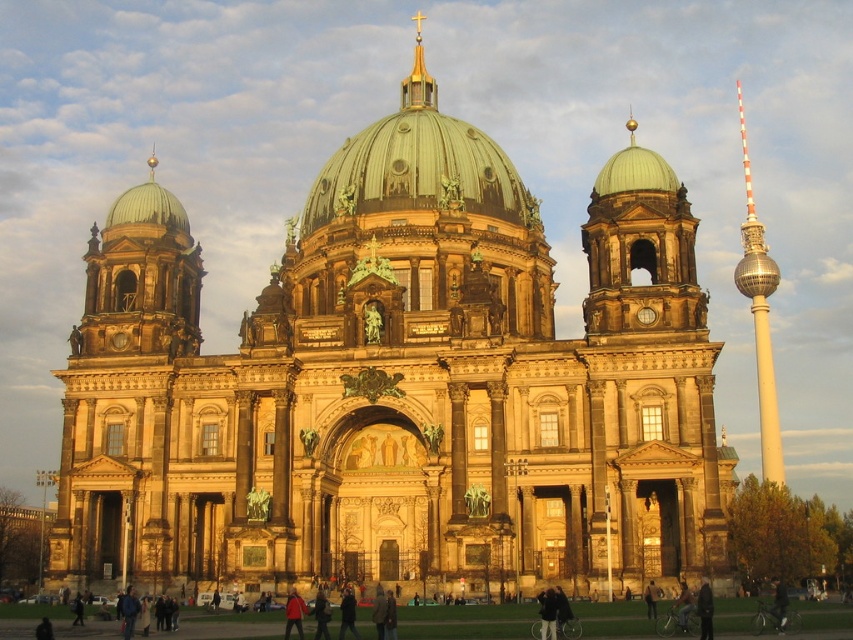
You are standing at the point marked by coordinates point (448,186) in front of Berlin Cathedral. The Fernsehturm is visible in the background. If you want to take a photo that includes both the cathedral and the Fernsehturm, would you need to zoom in or zoom out?

Since the point (448,186) is 87.84 meters away from the camera, you would need to zoom out to include both the Berlin Cathedral and the Fernsehturm in the photo.

You are standing at the base of the Berlin Cathedral and want to take a photo of the green copper dome at upper center. If you are exactly 68.77 meters away from it, will you be able to capture the entire dome in your photo without moving closer?

The green copper dome at upper center and viewer are 68.77 meters apart, so if you are exactly that distance away, you can capture the entire dome in your photo without needing to move closer, as the distance matches the required viewing distance for the dome to fit in the frame.